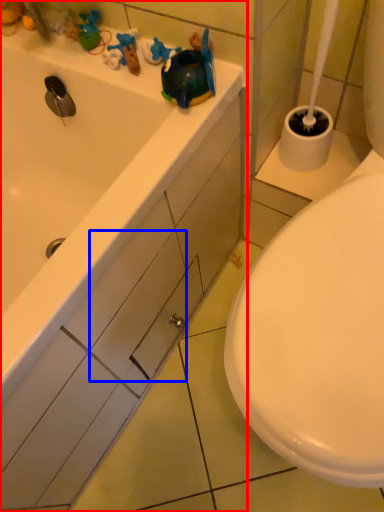
Question: Which object appears closest to the camera in this image, bathtub (highlighted by a red box) or drawer (highlighted by a blue box)?

Choices:
 (A) bathtub
 (B) drawer

Answer: (A)